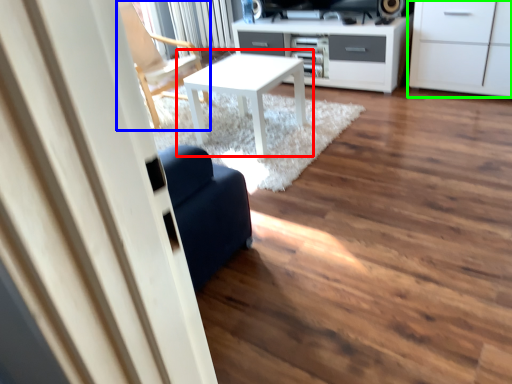
Question: Considering the real-world distances, which object is closest to table (highlighted by a red box)? chair (highlighted by a blue box) or cabinetry (highlighted by a green box).

Choices:
 (A) chair
 (B) cabinetry

Answer: (A)